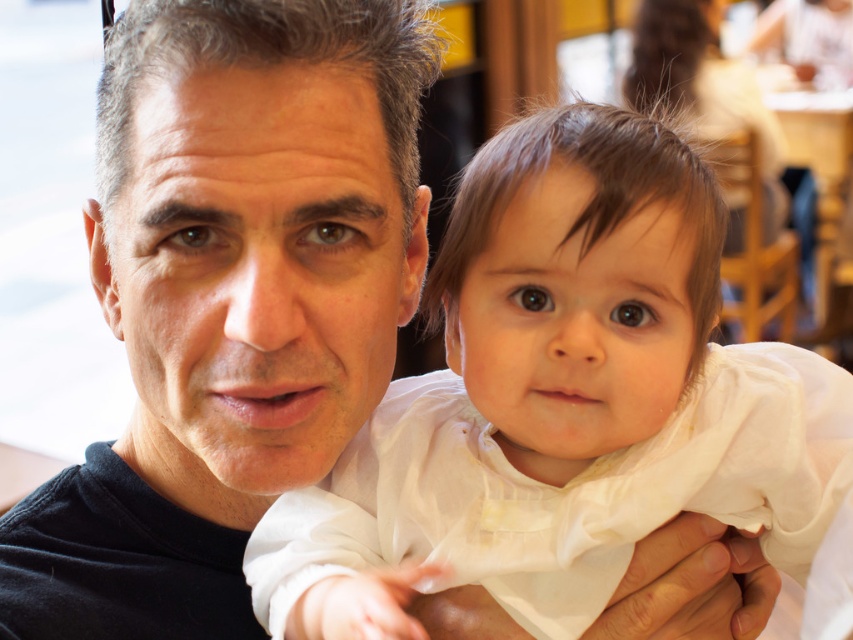
In the scene shown: You are a photographer adjusting the lighting in the studio. You notice the white silky dress at center and the black matte shirt at center. Which one will require more light to be properly illuminated?

The white silky dress at center is in front of the black matte shirt at center, so it will require more light to be properly illuminated because it is closer to the camera and may reflect more light due to its color and texture.

What is the exact position of the white silky dress at center in the image?

The white silky dress at center is located at point (561, 403).